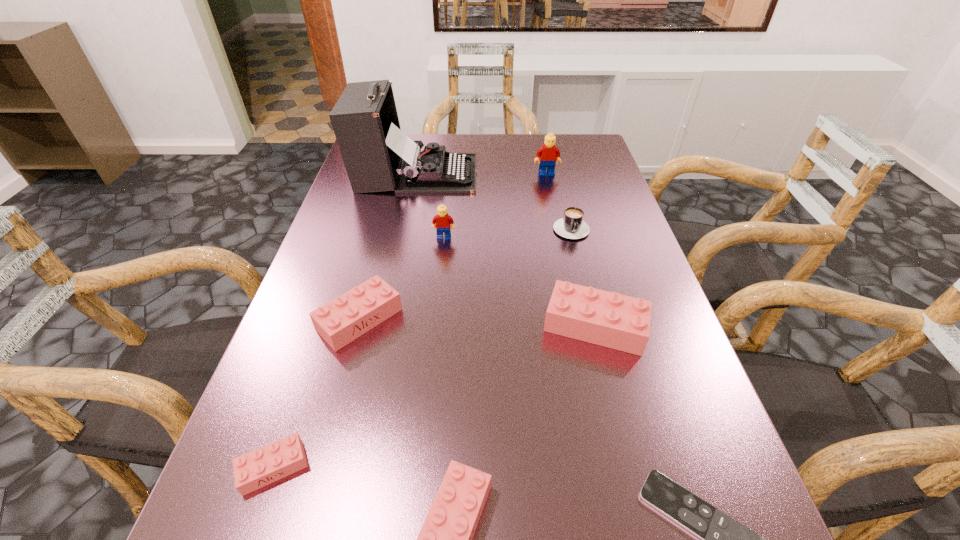
Locate an element on the screen. The height and width of the screenshot is (540, 960). typewriter is located at coordinates (378, 156).

Locate an element on the screen. Image resolution: width=960 pixels, height=540 pixels. the farthest Lego is located at coordinates click(x=549, y=154).

Image resolution: width=960 pixels, height=540 pixels. Find the location of `the tallest Lego`. the tallest Lego is located at coordinates (549, 154).

Where is `the second tallest Lego`? This screenshot has width=960, height=540. the second tallest Lego is located at coordinates (442, 220).

The height and width of the screenshot is (540, 960). I want to click on the nearer yellow Lego, so click(442, 220).

At what (x,y) coordinates should I click in order to perform the action: click on the rightmost pink Lego. Please return your answer as a coordinate pair (x, y). Looking at the image, I should click on (609, 319).

Locate an element on the screen. the sixth shortest object is located at coordinates (609, 319).

I want to click on the fourth tallest Lego, so click(x=342, y=320).

At what (x,y) coordinates should I click in order to perform the action: click on cappuccino. Please return your answer as a coordinate pair (x, y). The height and width of the screenshot is (540, 960). Looking at the image, I should click on (572, 226).

Where is `the smallest pink Lego`? The image size is (960, 540). the smallest pink Lego is located at coordinates (256, 469).